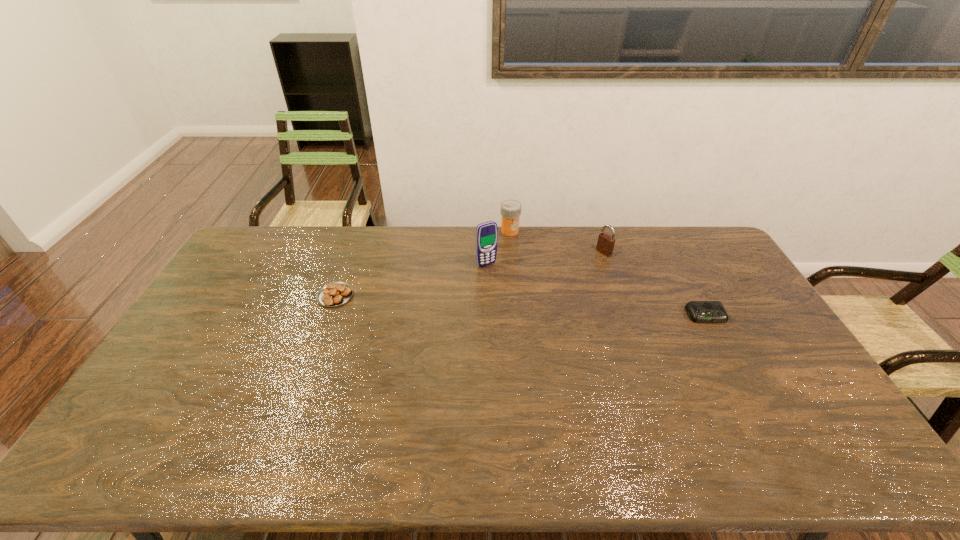
Where is `free spot that satisfies the following two spatial constraints: 1. on the front side of the third object from right to left; 2. on the right side of the padlock`? This screenshot has height=540, width=960. free spot that satisfies the following two spatial constraints: 1. on the front side of the third object from right to left; 2. on the right side of the padlock is located at coordinates (512, 252).